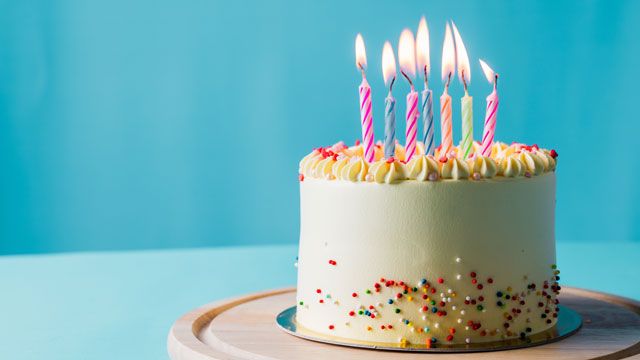
What are the coordinates of `candle flames` in the screenshot? It's located at (486, 73), (466, 64), (454, 64), (420, 57), (408, 59), (388, 65), (362, 56).